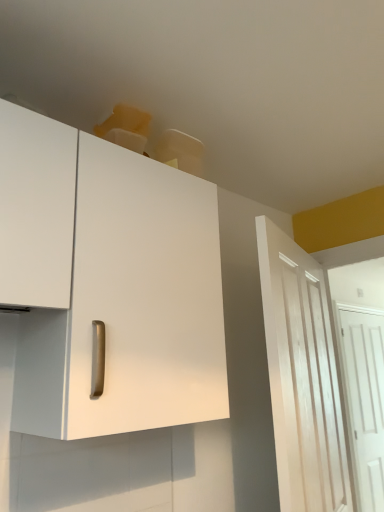
The width and height of the screenshot is (384, 512). Describe the element at coordinates (108, 283) in the screenshot. I see `white matte cabinet at upper left` at that location.

The height and width of the screenshot is (512, 384). What are the coordinates of `white wooden door at right, the first door from the right` in the screenshot? It's located at (365, 400).

The height and width of the screenshot is (512, 384). What do you see at coordinates (365, 400) in the screenshot?
I see `white wooden door at right, the second door viewed from the left` at bounding box center [365, 400].

Where is `white wood door at right, marked as the 2th door in a right-to-left arrangement`? white wood door at right, marked as the 2th door in a right-to-left arrangement is located at coordinates (302, 377).

Based on the photo, could you tell me if white matte cabinet at upper left is facing white wooden door at right, which is the 2th door from front to back?

No.

Based on the photo, is white matte cabinet at upper left taller than white wooden door at right, the first door from the right?

No, white matte cabinet at upper left is not taller than white wooden door at right, the first door from the right.

Considering the sizes of white matte cabinet at upper left and white wooden door at right, which is the 2th door from front to back, in the image, is white matte cabinet at upper left bigger or smaller than white wooden door at right, which is the 2th door from front to back,?

white matte cabinet at upper left is bigger than white wooden door at right, which is the 2th door from front to back.

From the image's perspective, is white matte cabinet at upper left located above white wooden door at right, which is counted as the 1th door, starting from the back?

Yes, from the image's perspective, white matte cabinet at upper left is above white wooden door at right, which is counted as the 1th door, starting from the back.

Looking at this image, is white wooden door at right, the first door from the right, oriented towards white wood door at right, the 1th door when ordered from front to back?

No, white wooden door at right, the first door from the right, is not oriented towards white wood door at right, the 1th door when ordered from front to back.

From the image's perspective, which one is positioned lower, white wooden door at right, the first door from the right, or white wood door at right, marked as the 2th door in a right-to-left arrangement?

From the image's view, white wooden door at right, the first door from the right, is below.

Based on their sizes in the image, would you say white wooden door at right, which is counted as the 1th door, starting from the back, is bigger or smaller than white wood door at right, marked as the 2th door in a right-to-left arrangement?

Clearly, white wooden door at right, which is counted as the 1th door, starting from the back, is smaller in size than white wood door at right, marked as the 2th door in a right-to-left arrangement.

From the image's perspective, is white wood door at right, which is counted as the 2th door, starting from the back, located above or below white wooden door at right, the second door viewed from the left?

From the image's perspective, white wood door at right, which is counted as the 2th door, starting from the back, appears above white wooden door at right, the second door viewed from the left.

From their relative heights in the image, would you say white wood door at right, marked as the 2th door in a right-to-left arrangement, is taller or shorter than white wooden door at right, which is the 2th door from front to back?

Clearly, white wood door at right, marked as the 2th door in a right-to-left arrangement, is shorter compared to white wooden door at right, which is the 2th door from front to back.

Does point (285, 438) lie behind point (351, 384)?

No, it is not.

Is white wood door at right, marked as the 2th door in a right-to-left arrangement, not near white wooden door at right, which is the 2th door from front to back?

Yes, white wood door at right, marked as the 2th door in a right-to-left arrangement, and white wooden door at right, which is the 2th door from front to back, are located far from each other.

Is point (364, 496) positioned behind point (82, 262)?

Yes, it is behind point (82, 262).

Can you confirm if white wooden door at right, which is counted as the 1th door, starting from the back, is positioned to the right of white matte cabinet at upper left?

Indeed, white wooden door at right, which is counted as the 1th door, starting from the back, is positioned on the right side of white matte cabinet at upper left.

Is white wooden door at right, the second door viewed from the left, far from white matte cabinet at upper left?

Yes, white wooden door at right, the second door viewed from the left, and white matte cabinet at upper left are quite far apart.

Considering the relative positions of white wooden door at right, the first door from the right, and white matte cabinet at upper left in the image provided, is white wooden door at right, the first door from the right, in front of white matte cabinet at upper left?

No, the depth of white wooden door at right, the first door from the right, is greater than that of white matte cabinet at upper left.

From the image's perspective, is white matte cabinet at upper left above white wood door at right, which ranks as the 1th door in left-to-right order?

Yes.

Which is more to the left, white matte cabinet at upper left or white wood door at right, which ranks as the 1th door in left-to-right order?

From the viewer's perspective, white matte cabinet at upper left appears more on the left side.

Can you tell me how much white matte cabinet at upper left and white wood door at right, the 1th door when ordered from front to back, differ in facing direction?

The angular difference between white matte cabinet at upper left and white wood door at right, the 1th door when ordered from front to back, is 19.3 degrees.

Is white matte cabinet at upper left touching white wood door at right, the 1th door when ordered from front to back?

white matte cabinet at upper left and white wood door at right, the 1th door when ordered from front to back, are not in contact.

Between white wood door at right, the 1th door when ordered from front to back, and white matte cabinet at upper left, which one has smaller size?

white wood door at right, the 1th door when ordered from front to back, is smaller.

In the scene shown: Is white wood door at right, marked as the 2th door in a right-to-left arrangement, directly adjacent to white matte cabinet at upper left?

There is a gap between white wood door at right, marked as the 2th door in a right-to-left arrangement, and white matte cabinet at upper left.

Where is `cabinetry on the left of the white wood door at right, which is counted as the 2th door, starting from the back`? The width and height of the screenshot is (384, 512). cabinetry on the left of the white wood door at right, which is counted as the 2th door, starting from the back is located at coordinates (108, 283).

Considering the relative positions of white wood door at right, marked as the 2th door in a right-to-left arrangement, and white matte cabinet at upper left in the image provided, is white wood door at right, marked as the 2th door in a right-to-left arrangement, to the left of white matte cabinet at upper left from the viewer's perspective?

No, white wood door at right, marked as the 2th door in a right-to-left arrangement, is not to the left of white matte cabinet at upper left.

In order to click on cabinetry above the white wooden door at right, the second door viewed from the left (from a real-world perspective) in this screenshot , I will do `click(108, 283)`.

I want to click on door below the white wood door at right, the 1th door when ordered from front to back (from a real-world perspective), so click(365, 400).

When comparing their distances from white wooden door at right, which is counted as the 1th door, starting from the back, does white matte cabinet at upper left or white wood door at right, which ranks as the 1th door in left-to-right order, seem further?

white matte cabinet at upper left.

From the image, which object appears to be farther from white matte cabinet at upper left, white wood door at right, which ranks as the 1th door in left-to-right order, or white wooden door at right, the second door viewed from the left?

white wooden door at right, the second door viewed from the left, is positioned further to the anchor white matte cabinet at upper left.

Considering their positions, is white matte cabinet at upper left positioned further to white wood door at right, marked as the 2th door in a right-to-left arrangement, than white wooden door at right, the second door viewed from the left?

white wooden door at right, the second door viewed from the left.

Based on their spatial positions, is white wooden door at right, which is the 2th door from front to back, or white matte cabinet at upper left closer to white wood door at right, which is counted as the 2th door, starting from the back?

The object closer to white wood door at right, which is counted as the 2th door, starting from the back, is white matte cabinet at upper left.

Considering their positions, is white wooden door at right, the first door from the right, positioned further to white matte cabinet at upper left than white wood door at right, marked as the 2th door in a right-to-left arrangement?

white wooden door at right, the first door from the right, is positioned further to the anchor white matte cabinet at upper left.

Estimate the real-world distances between objects in this image. Which object is further from white wooden door at right, which is the 2th door from front to back, white wood door at right, the 1th door when ordered from front to back, or white matte cabinet at upper left?

white matte cabinet at upper left lies further to white wooden door at right, which is the 2th door from front to back, than the other object.

This screenshot has width=384, height=512. I want to click on door located between white matte cabinet at upper left and white wooden door at right, which is the 2th door from front to back, in the depth direction, so click(x=302, y=377).